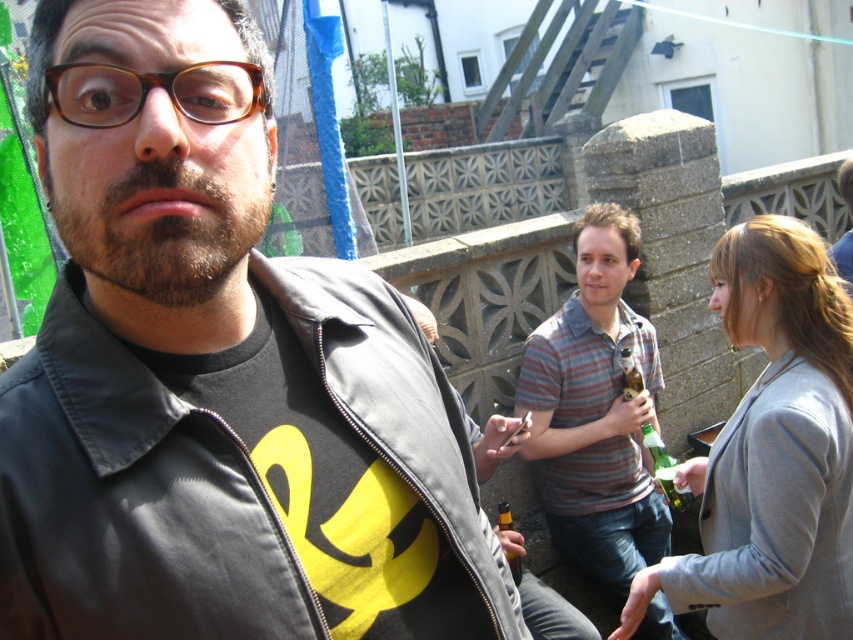
You are at a party and want to grab the translucent glass bottle at center without touching the matte black jacket at center. Is this possible?

The matte black jacket at center is much taller than the translucent glass bottle at center, so you can reach the translucent glass bottle at center without touching the matte black jacket at center by moving around it.

You are at a party and want to grab the translucent glass bottle at center. The striped cotton shirt at center is in the way. Can you reach the bottle without moving the shirt?

The striped cotton shirt at center is much taller than the translucent glass bottle at center, so you would need to move the shirt to access the bottle.

You are standing at the point labeled point (247, 148) and want to reach a friend who is 40 inches away from you. Can you reach them without moving?

The distance between you and your friend at point (247, 148) is 38.18 inches, which is less than 40 inches, so yes, you can reach them without moving.